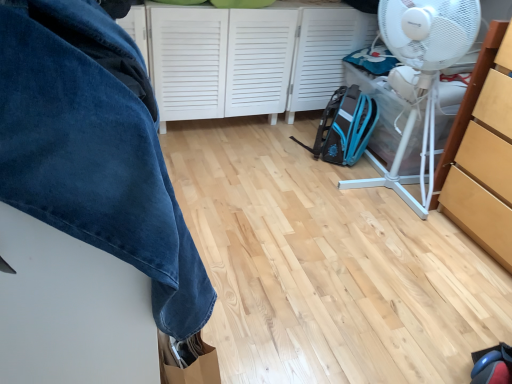
You are a GUI agent. You are given a task and a screenshot of the screen. Output one action in this format:
    pyautogui.click(x=<x>, y=<y>)
    Task: Click on the vacant area in front of teal fabric backpack at center-right
    
    Given the screenshot: What is the action you would take?
    pyautogui.click(x=339, y=184)